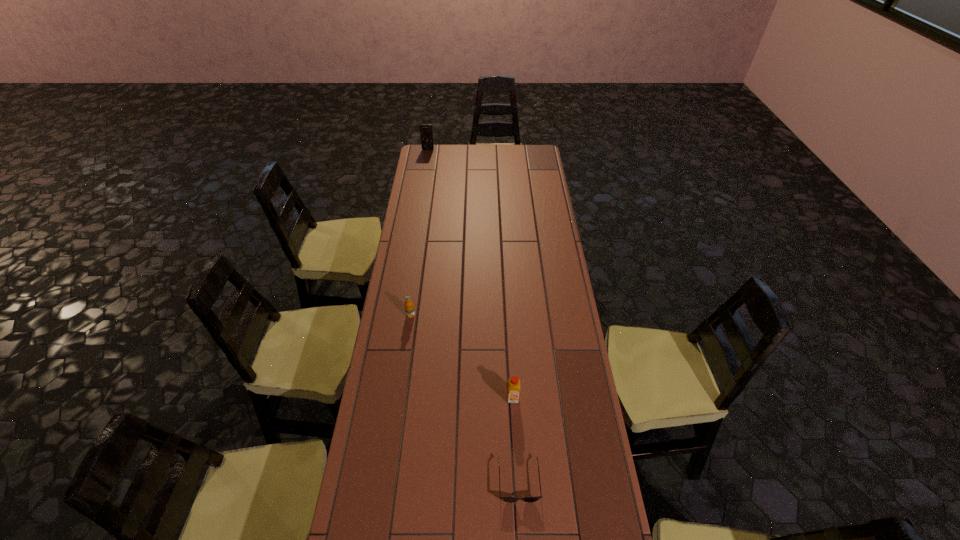
I want to click on object that is the third nearest to the sunglasses, so click(426, 133).

Find the location of `object that stands as the third closest to the nearer orange juice`. object that stands as the third closest to the nearer orange juice is located at coordinates (426, 133).